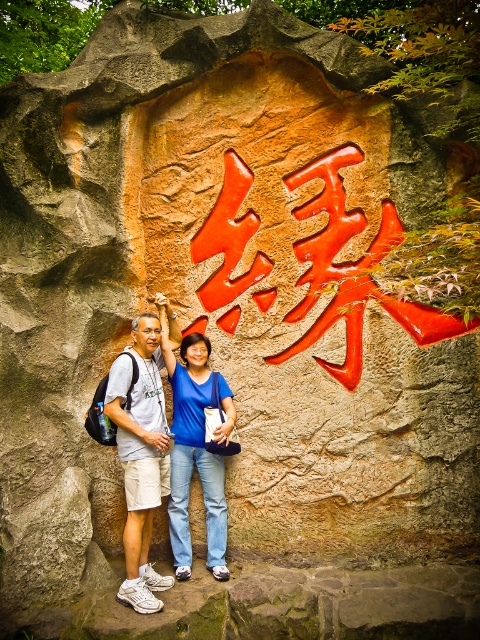
Question: Which point is closer to the camera?

Choices:
 (A) blue denim jeans at center
 (B) white athletic shoes at left

Answer: (B)

Question: Does white athletic shoes at left appear over blue denim jeans at center?

Choices:
 (A) yes
 (B) no

Answer: (B)

Question: Does white athletic shoes at left come behind blue denim jeans at center?

Choices:
 (A) no
 (B) yes

Answer: (A)

Question: Can you confirm if white athletic shoes at left is smaller than blue denim jeans at center?

Choices:
 (A) yes
 (B) no

Answer: (B)

Question: Among these points, which one is farthest from the camera?

Choices:
 (A) (137, 416)
 (B) (192, 385)

Answer: (B)

Question: Which point appears farthest from the camera in this image?

Choices:
 (A) (210, 520)
 (B) (144, 561)

Answer: (A)